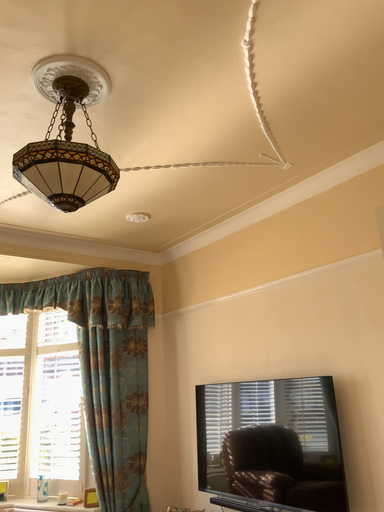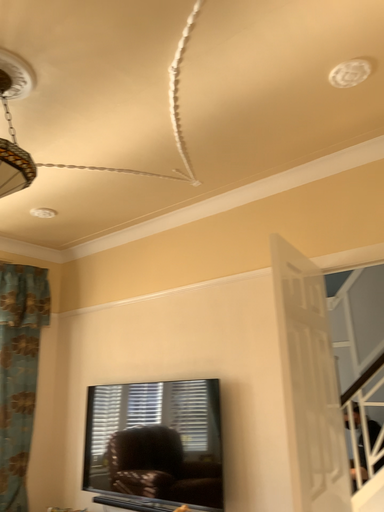
Question: Which way did the camera rotate in the video?

Choices:
 (A) rotated right
 (B) rotated left

Answer: (A)